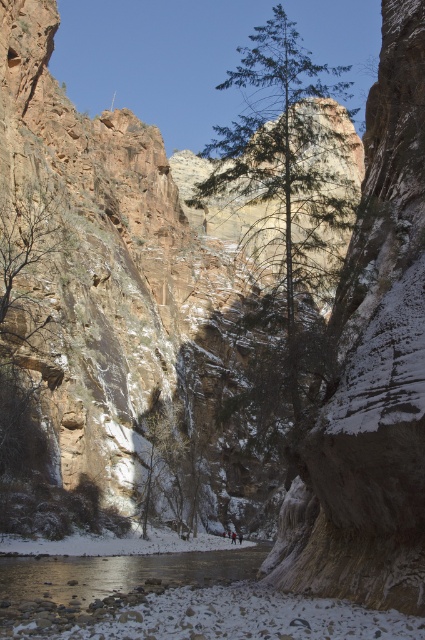
Is green textured tree at center smaller than red jacket at center?

Actually, green textured tree at center might be larger than red jacket at center.

Based on the photo, does green textured tree at center have a lesser height compared to red jacket at center?

No.

Which is in front, point (263, 65) or point (235, 534)?

Point (263, 65) is in front.

The width and height of the screenshot is (425, 640). What are the coordinates of `green textured tree at center` in the screenshot? It's located at (288, 212).

Which is in front, point (54, 596) or point (231, 534)?

Point (54, 596)

Does clear water at lower center have a greater height compared to red jacket at center?

Yes.

Describe the element at coordinates (122, 572) in the screenshot. The height and width of the screenshot is (640, 425). I see `clear water at lower center` at that location.

What are the coordinates of `clear water at lower center` in the screenshot? It's located at (122, 572).

Is green textured tree at center above clear water at lower center?

Indeed, green textured tree at center is positioned over clear water at lower center.

Between green textured tree at center and clear water at lower center, which one has more height?

green textured tree at center is taller.

I want to click on green textured tree at center, so click(x=288, y=212).